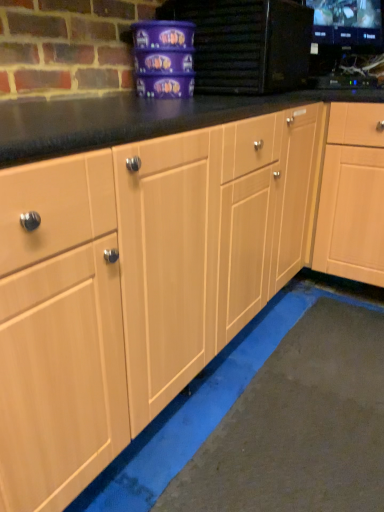
This screenshot has width=384, height=512. I want to click on light wood cabinet at center, so click(352, 195).

Image resolution: width=384 pixels, height=512 pixels. Describe the element at coordinates (348, 22) in the screenshot. I see `black glossy monitor at upper right` at that location.

This screenshot has height=512, width=384. Identify the location of black glossy monitor at upper right. (348, 22).

Find the location of a particular element. The image size is (384, 512). light wood cabinet at center is located at coordinates point(352,195).

Is light wood cabinet at center directly adjacent to black glossy tv at upper right, which is the first appliance from right to left?

No, light wood cabinet at center is not making contact with black glossy tv at upper right, which is the first appliance from right to left.

Does point (334, 108) come in front of point (376, 80)?

Yes, it is in front of point (376, 80).

Between light wood cabinet at center and black glossy tv at upper right, the second appliance when ordered from left to right, which one has smaller size?

black glossy tv at upper right, the second appliance when ordered from left to right, is smaller.

Is light wood cabinet at center wider than black glossy tv at upper right, the second appliance when ordered from left to right?

Indeed, light wood cabinet at center has a greater width compared to black glossy tv at upper right, the second appliance when ordered from left to right.

From a real-world perspective, which object stands above the other?

In real-world perspective, matte purple container at upper center, which is the second appliance in right-to-left order, is above.

Is point (354, 239) farther from viewer compared to point (258, 0)?

Yes, point (354, 239) is farther from viewer.

From the image's perspective, is light wood cabinet at center above or below matte purple container at upper center, the first appliance in the left-to-right sequence?

From the image's perspective, light wood cabinet at center appears below matte purple container at upper center, the first appliance in the left-to-right sequence.

At what (x,y) coordinates should I click in order to perform the action: click on appliance in front of the light wood cabinet at center. Please return your answer as a coordinate pair (x, y). The image size is (384, 512). Looking at the image, I should click on (246, 44).

Which object is closer to the camera taking this photo, matte purple container at upper center, the first appliance in the left-to-right sequence, or black glossy tv at upper right, the second appliance when ordered from left to right?

matte purple container at upper center, the first appliance in the left-to-right sequence, is more forward.

Which of these two, matte purple container at upper center, the first appliance in the left-to-right sequence, or black glossy tv at upper right, which is the first appliance from right to left, stands shorter?

Standing shorter between the two is black glossy tv at upper right, which is the first appliance from right to left.

From a real-world perspective, which object stands above the other?

matte purple container at upper center, the first appliance in the left-to-right sequence.

You are a GUI agent. You are given a task and a screenshot of the screen. Output one action in this format:
    pyautogui.click(x=<x>, y=<y>)
    Task: Click on the appliance that appears in front of the black glossy tv at upper right, the second appliance when ordered from left to right
    This screenshot has height=512, width=384.
    Given the screenshot: What is the action you would take?
    pyautogui.click(x=246, y=44)

Can we say black glossy tv at upper right, the second appliance when ordered from left to right, lies outside light wood cabinet at center?

black glossy tv at upper right, the second appliance when ordered from left to right, is positioned outside light wood cabinet at center.

Is black glossy tv at upper right, which is the first appliance from right to left, oriented towards light wood cabinet at center?

No.

In the scene shown: From a real-world perspective, is black glossy tv at upper right, the second appliance when ordered from left to right, under light wood cabinet at center?

No, from a real-world perspective, black glossy tv at upper right, the second appliance when ordered from left to right, is not below light wood cabinet at center.

From the image's perspective, relative to light wood cabinet at center, is black glossy tv at upper right, which is the first appliance from right to left, above or below?

black glossy tv at upper right, which is the first appliance from right to left, is above light wood cabinet at center.

From the image's perspective, which appliance is the 2nd one above the light wood cabinet at center? Please provide its 2D coordinates.

[(246, 44)]

Is matte purple container at upper center, which is the second appliance in right-to-left order, not near light wood cabinet at center?

Actually, matte purple container at upper center, which is the second appliance in right-to-left order, and light wood cabinet at center are a little close together.

Considering the sizes of matte purple container at upper center, the first appliance in the left-to-right sequence, and light wood cabinet at center in the image, is matte purple container at upper center, the first appliance in the left-to-right sequence, wider or thinner than light wood cabinet at center?

In the image, matte purple container at upper center, the first appliance in the left-to-right sequence, appears to be more narrow than light wood cabinet at center.

Does black glossy monitor at upper right lie behind matte purple container at upper center, the first appliance in the left-to-right sequence?

Yes, it is behind matte purple container at upper center, the first appliance in the left-to-right sequence.

Considering the positions of point (372, 2) and point (265, 35), is point (372, 2) closer or farther from the camera than point (265, 35)?

Point (372, 2).

From the image's perspective, is black glossy monitor at upper right above matte purple container at upper center, which is the second appliance in right-to-left order?

Yes, from the image's perspective, black glossy monitor at upper right is over matte purple container at upper center, which is the second appliance in right-to-left order.

Who is shorter, black glossy monitor at upper right or matte purple container at upper center, which is the second appliance in right-to-left order?

matte purple container at upper center, which is the second appliance in right-to-left order.

Find the location of a particular element. The width and height of the screenshot is (384, 512). computer monitor that appears above the matte purple container at upper center, which is the second appliance in right-to-left order (from the image's perspective) is located at coordinates (348, 22).

Is black glossy monitor at upper right completely or partially inside matte purple container at upper center, which is the second appliance in right-to-left order?

No, black glossy monitor at upper right is not a part of matte purple container at upper center, which is the second appliance in right-to-left order.

From a real-world perspective, is matte purple container at upper center, the first appliance in the left-to-right sequence, above or below black glossy monitor at upper right?

From a real-world perspective, matte purple container at upper center, the first appliance in the left-to-right sequence, is physically below black glossy monitor at upper right.

Who is more distant, matte purple container at upper center, the first appliance in the left-to-right sequence, or black glossy monitor at upper right?

black glossy monitor at upper right is behind.

What are the coordinates of `cabinetry located below the black glossy tv at upper right, which is the first appliance from right to left (from the image's perspective)` in the screenshot? It's located at (352, 195).

Locate an element on the screen. The width and height of the screenshot is (384, 512). cabinetry that is under the matte purple container at upper center, the first appliance in the left-to-right sequence (from a real-world perspective) is located at coordinates (352, 195).

Looking at the image, which one is located further to light wood cabinet at center, black glossy monitor at upper right or matte purple container at upper center, the first appliance in the left-to-right sequence?

black glossy monitor at upper right lies further to light wood cabinet at center than the other object.

Based on their spatial positions, is light wood cabinet at center or black glossy monitor at upper right closer to matte purple container at upper center, which is the second appliance in right-to-left order?

Among the two, light wood cabinet at center is located nearer to matte purple container at upper center, which is the second appliance in right-to-left order.

Considering their positions, is black glossy monitor at upper right positioned further to matte purple container at upper center, the first appliance in the left-to-right sequence, than light wood cabinet at center?

black glossy monitor at upper right lies further to matte purple container at upper center, the first appliance in the left-to-right sequence, than the other object.

When comparing their distances from black glossy monitor at upper right, does black glossy tv at upper right, which is the first appliance from right to left, or matte purple container at upper center, which is the second appliance in right-to-left order, seem further?

matte purple container at upper center, which is the second appliance in right-to-left order, lies further to black glossy monitor at upper right than the other object.

From the image, which object appears to be farther from black glossy tv at upper right, the second appliance when ordered from left to right, black glossy monitor at upper right or matte purple container at upper center, which is the second appliance in right-to-left order?

Among the two, matte purple container at upper center, which is the second appliance in right-to-left order, is located further to black glossy tv at upper right, the second appliance when ordered from left to right.

Considering their positions, is light wood cabinet at center positioned closer to black glossy tv at upper right, the second appliance when ordered from left to right, than matte purple container at upper center, the first appliance in the left-to-right sequence?

matte purple container at upper center, the first appliance in the left-to-right sequence, is positioned closer to the anchor black glossy tv at upper right, the second appliance when ordered from left to right.

Which object lies nearer to the anchor point black glossy tv at upper right, which is the first appliance from right to left, matte purple container at upper center, the first appliance in the left-to-right sequence, or light wood cabinet at center?

Based on the image, matte purple container at upper center, the first appliance in the left-to-right sequence, appears to be nearer to black glossy tv at upper right, which is the first appliance from right to left.

When comparing their distances from light wood cabinet at center, does black glossy monitor at upper right or black glossy tv at upper right, which is the first appliance from right to left, seem further?

Among the two, black glossy monitor at upper right is located further to light wood cabinet at center.

You are a GUI agent. You are given a task and a screenshot of the screen. Output one action in this format:
    pyautogui.click(x=<x>, y=<y>)
    Task: Click on the appliance situated between matte purple container at upper center, the first appliance in the left-to-right sequence, and light wood cabinet at center from left to right
    The width and height of the screenshot is (384, 512).
    Given the screenshot: What is the action you would take?
    (346, 80)

Locate an element on the screen. The width and height of the screenshot is (384, 512). computer monitor situated between matte purple container at upper center, the first appliance in the left-to-right sequence, and black glossy tv at upper right, the second appliance when ordered from left to right, from left to right is located at coordinates (348, 22).